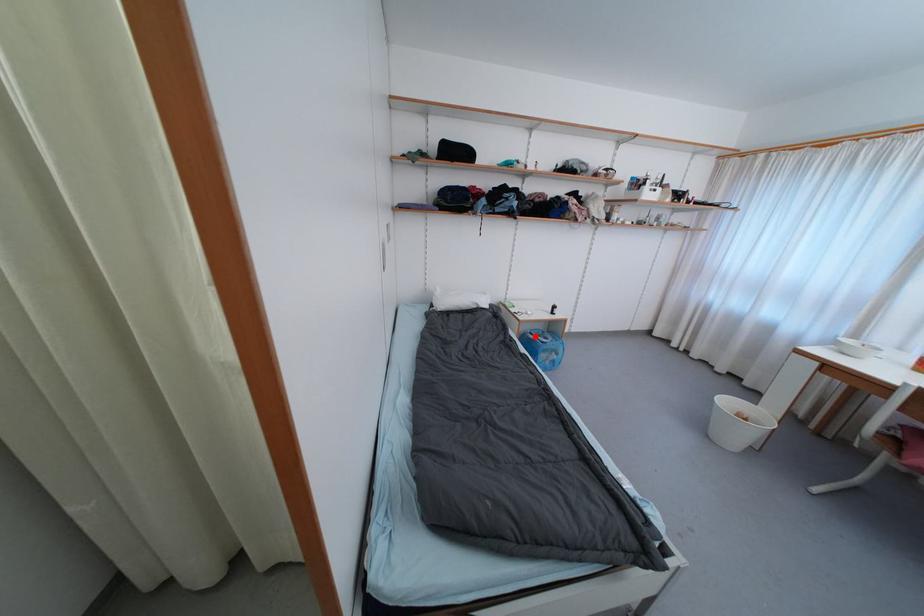
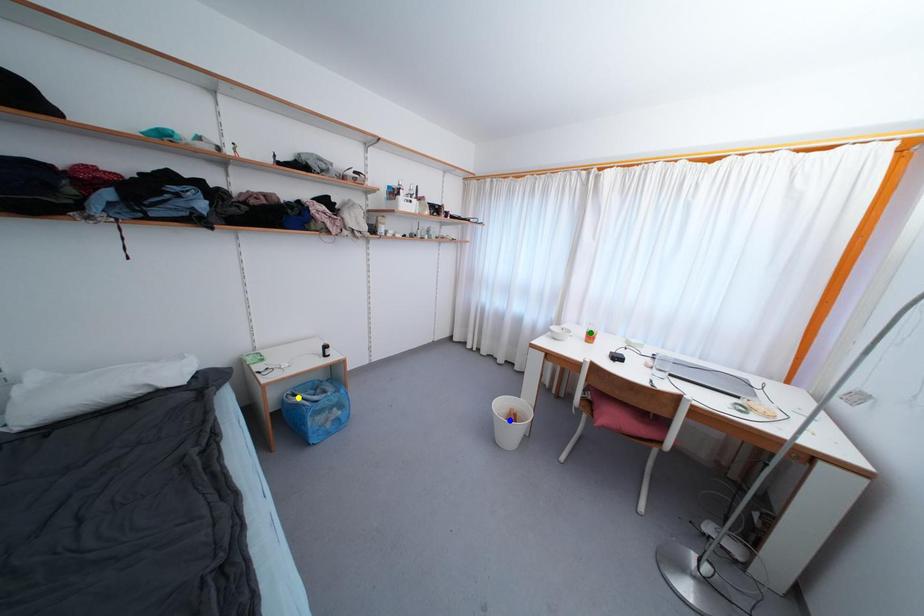
Question: I am providing you with two images of the same scene from different viewpoints. A red point is marked on the first image. You are given multiple points on the second image. In image 2, which mark is for the same physical point as the one in image 1?

Choices:
 (A) blue point
 (B) green point
 (C) yellow point

Answer: (C)